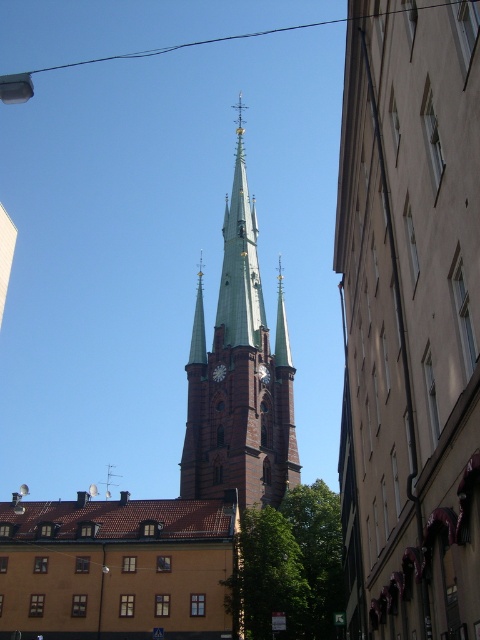
You are an architect planning to install a new lighting system for the brown brick church steeple at center and the brown brick tower at center. Given that the central spire of the church steeple is the tallest, which structure requires taller lighting poles to illuminate its highest point?

The brown brick church steeple at center requires taller lighting poles because it has a larger size compared to the brown brick tower at center, and its central spire is the tallest.

You are standing at the point with coordinates (167, 499) in the image. What object are you directly facing?

You are directly facing the brown brick church steeple at center.

You are a drone operator planning to fly a drone between the brown brick church steeple at center and the green metallic spire at center. Given that your drone has a maximum flight height of 30 meters, can you safely navigate between them without hitting either structure?

The brown brick church steeple at center is much taller than the green metallic spire at center. Since the drone has a 30 meter height limit, it depends on the actual heights. If the shorter green metallic spire is under 30 meters, the drone can fly below both. However, if the taller brown steeple exceeds 30 meters, the drone cannot safely navigate above it. Without exact measurements, we cannot confirm safety.